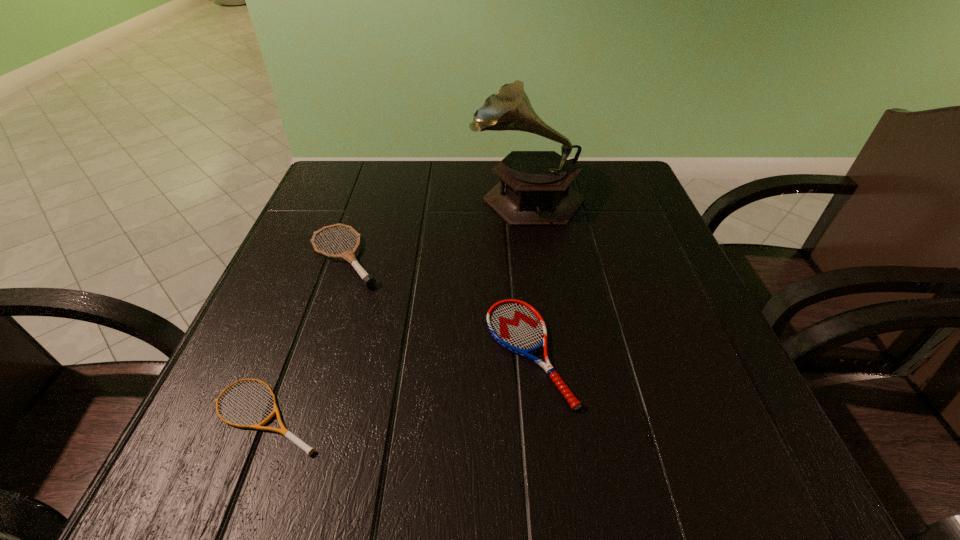
At what (x,y) coordinates should I click in order to perform the action: click on free space between the phonograph record and the third nearest object. Please return your answer as a coordinate pair (x, y). This screenshot has width=960, height=540. Looking at the image, I should click on (436, 226).

Image resolution: width=960 pixels, height=540 pixels. I want to click on empty space that is in between the farthest tennis racket and the third tallest object, so click(x=437, y=305).

Find the location of a particular element. The width and height of the screenshot is (960, 540). free space that is in between the third shortest object and the tallest object is located at coordinates (436, 226).

Locate which object is the third closest to the third shortest object. Please provide its 2D coordinates. Your answer should be formatted as a tuple, i.e. [(x, y)], where the tuple contains the x and y coordinates of a point satisfying the conditions above.

[(517, 326)]

Where is `object that can be found as the closest to the third tallest object`? object that can be found as the closest to the third tallest object is located at coordinates (368, 280).

The width and height of the screenshot is (960, 540). Find the location of `tennis racket identified as the closest to the tallest tennis racket`. tennis racket identified as the closest to the tallest tennis racket is located at coordinates pos(286,433).

Identify which tennis racket is located as the nearest to the shortest object. Please provide its 2D coordinates. Your answer should be formatted as a tuple, i.e. [(x, y)], where the tuple contains the x and y coordinates of a point satisfying the conditions above.

[(368, 280)]

I want to click on vacant space that satisfies the following two spatial constraints: 1. on the back side of the shortest object; 2. on the right side of the tallest tennis racket, so click(x=327, y=257).

The width and height of the screenshot is (960, 540). In order to click on free space that satisfies the following two spatial constraints: 1. on the horn direction of the farthest object; 2. on the front side of the shortest object in this screenshot , I will do pyautogui.click(x=558, y=413).